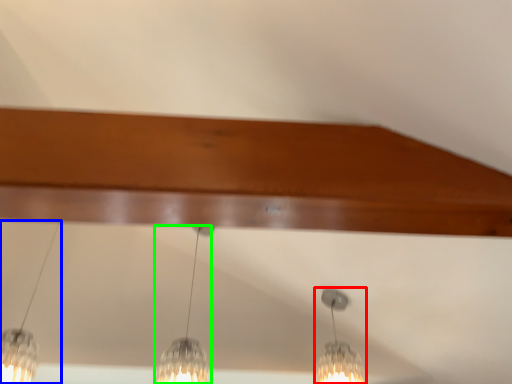
Question: Based on their relative distances, which object is farther from lamp (highlighted by a red box)? Choose from lamp (highlighted by a blue box) and lamp (highlighted by a green box).

Choices:
 (A) lamp
 (B) lamp

Answer: (A)